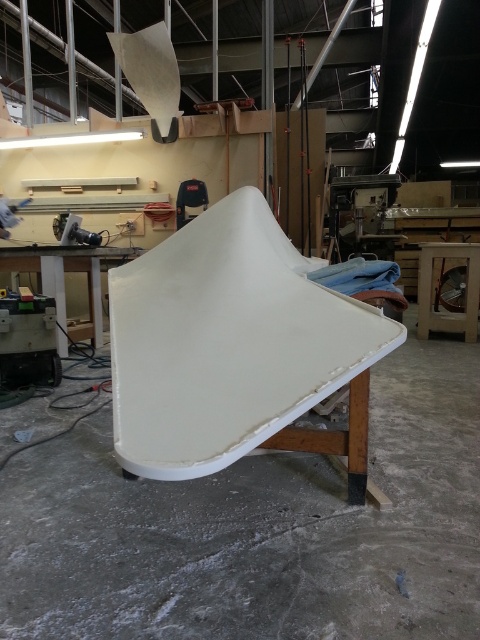
You are positioning a sticker on the white matte surfboard at center. The sticker needs to be placed exactly at the center of the surfboard. According to the coordinates provided, is the surfboard perfectly centered in the image?

The white matte surfboard at center is located at coordinates point [235,349], which is very close to the center of the image. Since the coordinates are nearly centered, the surfboard is considered to be perfectly centered for practical purposes.

You are a carpenter working in the workshop. You need to move the white matte surfboard at center to the storage area located behind the white matte workbench at left. Can you move it directly behind the workbench without lifting it over the workbench?

The white matte surfboard at center is below the white matte workbench at left, so it can be moved directly behind the workbench without needing to lift it over since it is already positioned under the workbench.

You are an apprentice in a workshop and need to move a tool from the white matte workbench at left to the white matte surfboard at center. Which direction should you move the tool to place it on the surfboard?

You should move the tool to the right to place it on the white matte surfboard at center since the surfboard is located to the right of the white matte workbench at left.